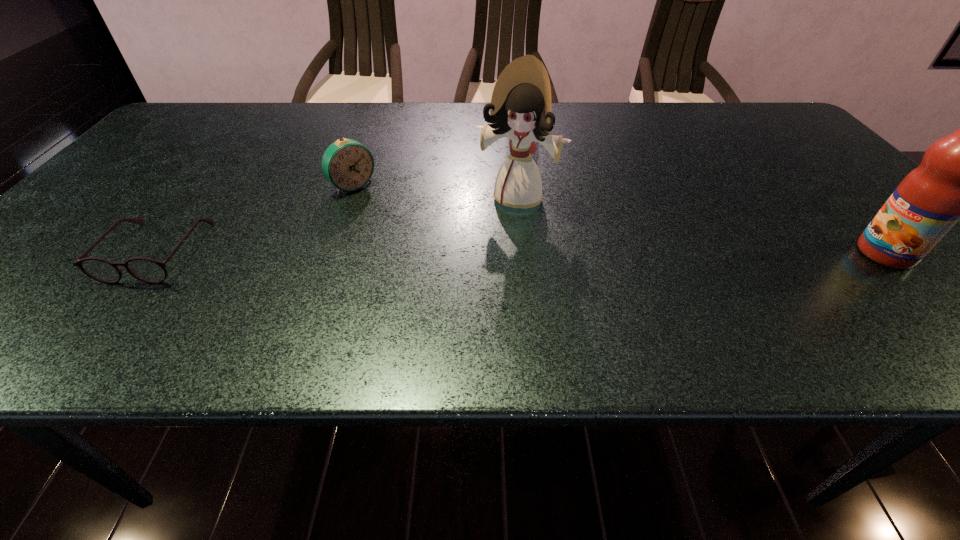
The width and height of the screenshot is (960, 540). What are the coordinates of `vacant region located 0.130m on the front-facing side of the second shortest object` in the screenshot? It's located at (395, 222).

This screenshot has height=540, width=960. Identify the location of free space located on the front-facing side of the second shortest object. (434, 256).

At what (x,y) coordinates should I click in order to perform the action: click on vacant space located 0.230m at the front face of the doll. Please return your answer as a coordinate pair (x, y). This screenshot has height=540, width=960. Looking at the image, I should click on (472, 284).

Image resolution: width=960 pixels, height=540 pixels. I want to click on free point located at the front face of the doll, so tap(468, 295).

Image resolution: width=960 pixels, height=540 pixels. What are the coordinates of `vacant region located at the front face of the doll` in the screenshot? It's located at (474, 281).

Where is `spectacles located at the near edge`? spectacles located at the near edge is located at coordinates [147, 270].

Identify the location of fruit juice that is at the near edge. (959, 177).

Where is `object located in the right edge section of the desktop`? Image resolution: width=960 pixels, height=540 pixels. object located in the right edge section of the desktop is located at coordinates (959, 177).

Identify the location of object located at the near right corner. (959, 177).

Identify the location of vacant area at the far edge. (290, 114).